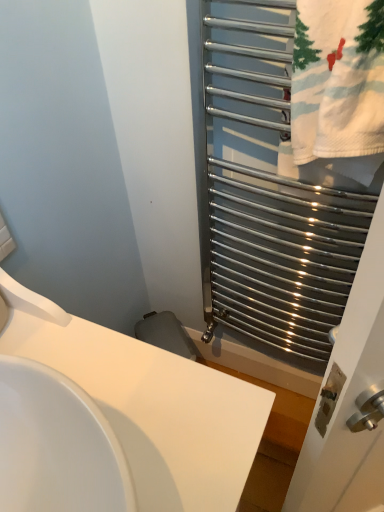
Question: Choose the correct answer: Is white glossy sink at center inside white cotton towel at right or outside it?

Choices:
 (A) inside
 (B) outside

Answer: (B)

Question: In terms of height, does white glossy sink at center look taller or shorter compared to white cotton towel at right?

Choices:
 (A) tall
 (B) short

Answer: (A)

Question: Estimate the real-world distances between objects in this image. Which object is farther from the white cotton towel at right?

Choices:
 (A) white glossy sink at center
 (B) polished metal towel rack at right

Answer: (A)

Question: Estimate the real-world distances between objects in this image. Which object is farther from the polished metal towel rack at right?

Choices:
 (A) white glossy sink at center
 (B) white cotton towel at right

Answer: (A)